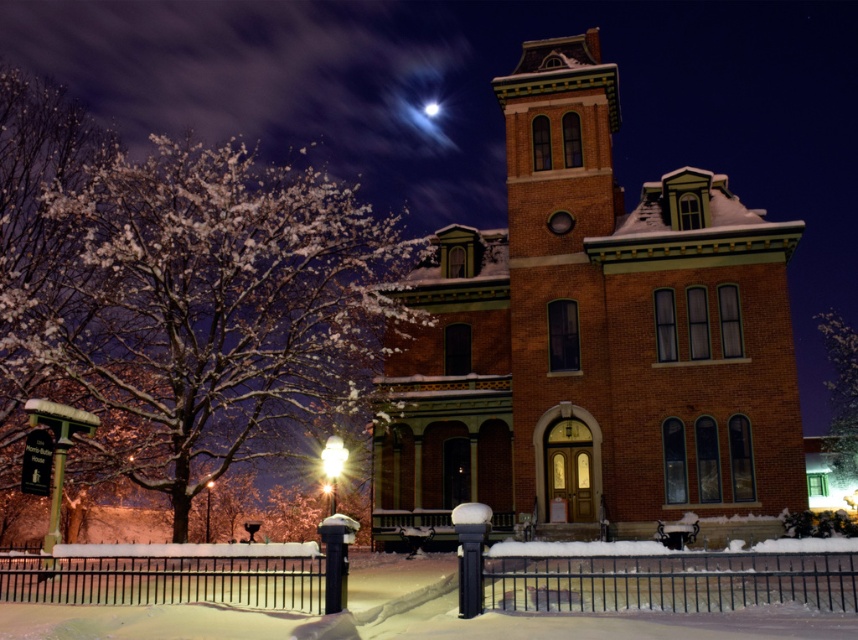
Question: Which object appears closest to the camera in this image?

Choices:
 (A) brick building at center
 (B) white snow-covered tree at right
 (C) snow-covered branches at left

Answer: (A)

Question: From the image, what is the correct spatial relationship of snow-covered branches at left in relation to white snow-covered tree at right?

Choices:
 (A) right
 (B) left

Answer: (B)

Question: Where is brick building at center located in relation to snow-covered branches at left in the image?

Choices:
 (A) right
 (B) left

Answer: (A)

Question: Which of the following is the closest to the observer?

Choices:
 (A) brick building at center
 (B) snow-covered branches at left

Answer: (A)

Question: Is snow-covered branches at left above white snow-covered tree at right?

Choices:
 (A) yes
 (B) no

Answer: (A)

Question: Which of the following is the closest to the observer?

Choices:
 (A) (600, 454)
 (B) (844, 372)
 (C) (322, 369)

Answer: (A)